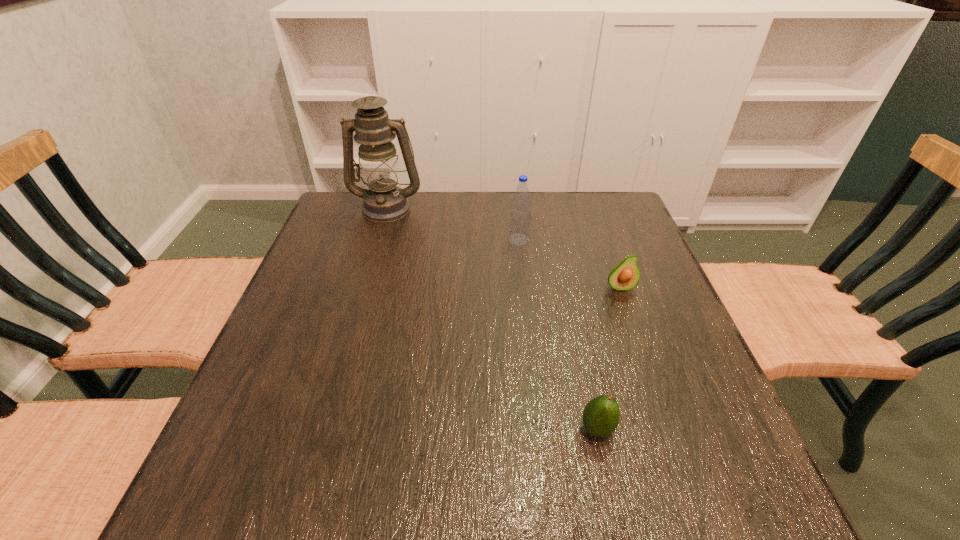
Locate an element on the screen. This screenshot has width=960, height=540. free space at the right edge of the desktop is located at coordinates (697, 421).

The width and height of the screenshot is (960, 540). I want to click on free space at the far left corner, so click(359, 235).

At what (x,y) coordinates should I click in order to perform the action: click on free space at the far right corner of the desktop. Please return your answer as a coordinate pair (x, y). This screenshot has height=540, width=960. Looking at the image, I should click on (602, 195).

The image size is (960, 540). Find the location of `unoccupied area between the right avocado and the third nearest object`. unoccupied area between the right avocado and the third nearest object is located at coordinates (569, 264).

Image resolution: width=960 pixels, height=540 pixels. What are the coordinates of `vacant space that's between the oil lamp and the nearest object` in the screenshot? It's located at (492, 319).

Locate an element on the screen. This screenshot has width=960, height=540. free point between the leftmost object and the right avocado is located at coordinates (503, 248).

At what (x,y) coordinates should I click in order to perform the action: click on free space between the farthest object and the water bottle. Please return your answer as a coordinate pair (x, y). The width and height of the screenshot is (960, 540). Looking at the image, I should click on (453, 224).

The width and height of the screenshot is (960, 540). In order to click on vacant space that's between the nearest object and the third object from right to left in this screenshot , I will do `click(558, 334)`.

Find the location of a particular element. free spot between the third farthest object and the shorter avocado is located at coordinates (609, 358).

Identify the location of blank region between the third object from right to left and the third farthest object. This screenshot has width=960, height=540. (569, 264).